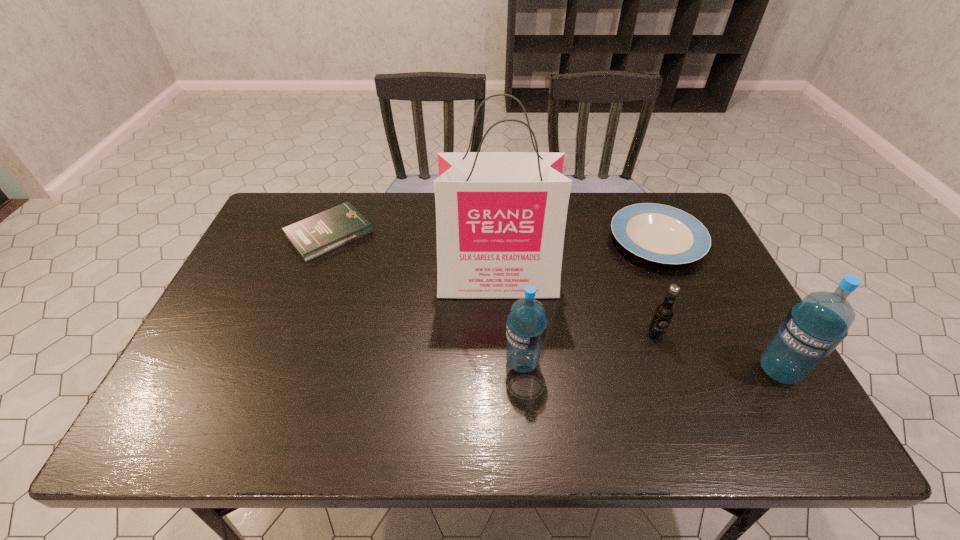
I want to click on vacant position located 0.370m on the back of the third tallest object, so click(513, 247).

At what (x,y) coordinates should I click in order to perform the action: click on free space located 0.340m on the back of the right water bottle. Please return your answer as a coordinate pair (x, y). This screenshot has width=960, height=540. Looking at the image, I should click on (715, 257).

Locate an element on the screen. free spot located 0.140m on the front of the plate is located at coordinates (687, 310).

Find the location of a particular element. Image resolution: width=960 pixels, height=540 pixels. free space located on the front-facing side of the shopping bag is located at coordinates (502, 396).

This screenshot has width=960, height=540. Find the location of `free region located 0.150m on the label of the fourth farthest object`. free region located 0.150m on the label of the fourth farthest object is located at coordinates (677, 395).

In order to click on vacant area located 0.300m on the right of the book in this screenshot , I will do `click(468, 234)`.

Where is `plate at the far edge`? This screenshot has height=540, width=960. plate at the far edge is located at coordinates (659, 233).

The width and height of the screenshot is (960, 540). I want to click on book at the far edge, so click(314, 236).

The image size is (960, 540). I want to click on object that is at the left edge, so click(x=314, y=236).

Where is `water bottle at the right edge`? water bottle at the right edge is located at coordinates (813, 328).